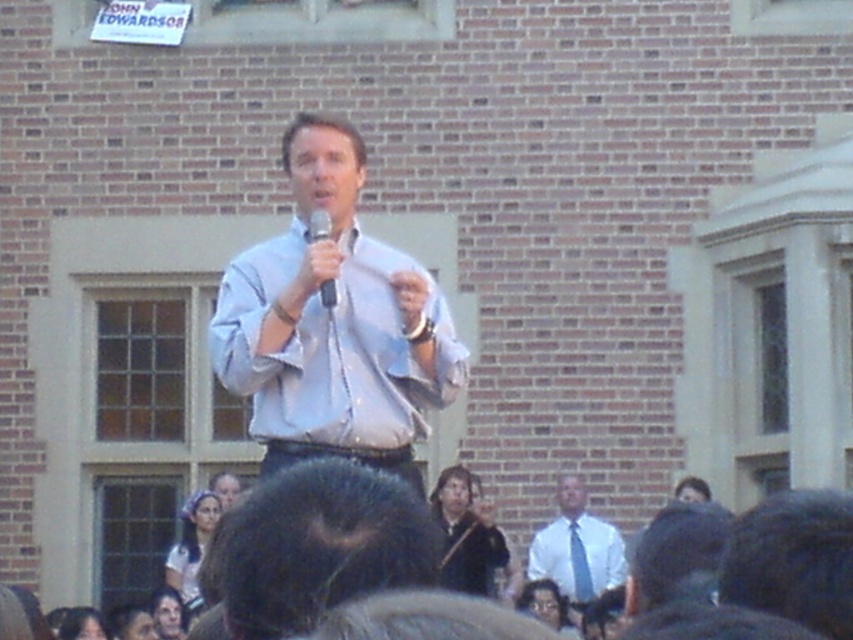
You are standing at the speaker position in the public speaking event. There is a point at coordinates point (167, 621). Can you see this point from your current position?

The distance of point (167, 621) from viewer is 193.03 feet, so yes, you can see this point from your current position because it is within your line of sight.

You are standing at the back of the audience and want to take a photo of the speaker. There are two points in the image labeled as point 1 at coordinates point (x=305, y=540) and point 2 at coordinates point (x=335, y=289). Which point should you focus on to ensure the speaker is in focus?

Point 1 at coordinates point (x=305, y=540) is closer to the camera than point 2 at coordinates point (x=335, y=289). Therefore, focusing on point 1 will ensure the speaker is in focus since it is nearer to the camera.

What is the position of the smooth skin face at lower left in the image?

The smooth skin face at lower left is located at point (167,612).